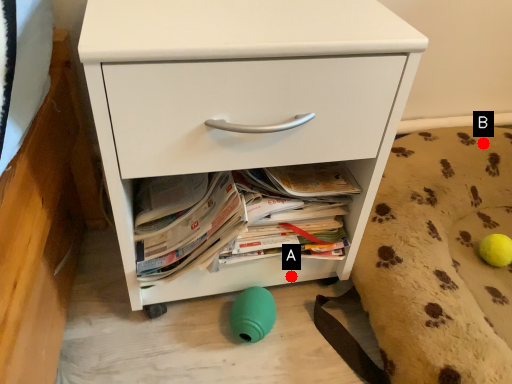
Question: Two points are circled on the image, labeled by A and B beside each circle. Among these points, which one is farthest from the camera?

Choices:
 (A) A is further
 (B) B is further

Answer: (B)